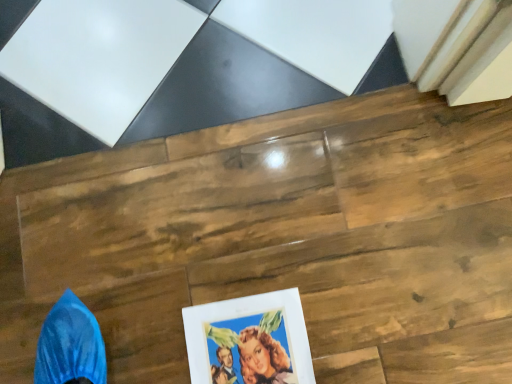
The height and width of the screenshot is (384, 512). What are the coordinates of `free space above matte white picture frame at lower center (from a real-world perspective)` in the screenshot? It's located at (251, 348).